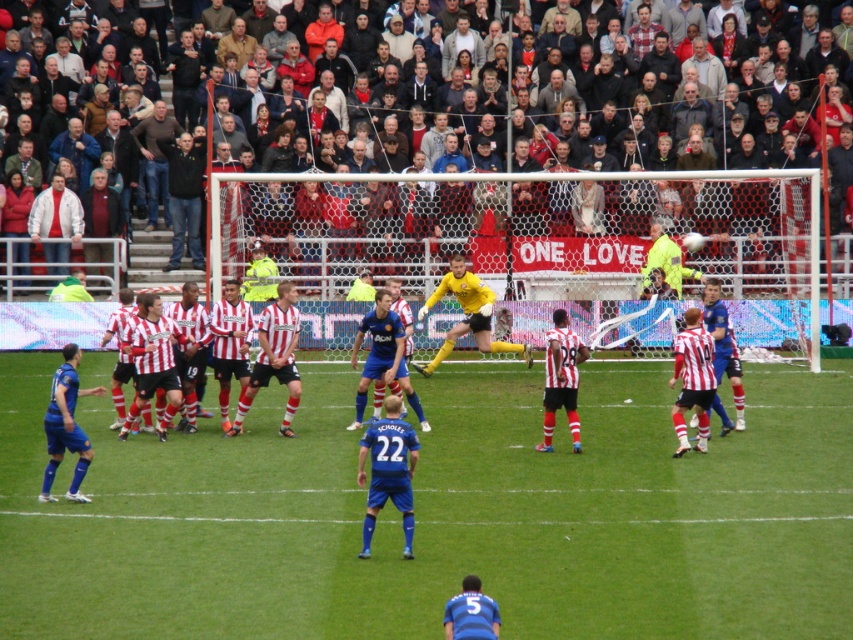
You are a soccer player trying to pass the ball from the green grass football field at center to the matte red and white jersey at center. Since both are at the center, what spatial detail should you consider to ensure the pass reaches the intended target?

The green grass football field at center is wider than the matte red and white jersey at center, so you should aim towards the wider area of the field to ensure the pass reaches the intended target.

You are a photographer at the soccer match and want to capture a closeup of the yellow matte football at center and the brown leather jacket at upper center in the same frame. Which object should you zoom in on to ensure both are visible without cropping?

The yellow matte football at center is larger in size than the brown leather jacket at upper center, so you should zoom in on the football to ensure both objects remain visible without cropping.

You are a soccer coach analyzing the game from the sidelines. You notice the green grass football field at center and the matte red and white jersey at center. How far apart are these two objects?

The green grass football field at center and the matte red and white jersey at center are 9.19 feet apart from each other.